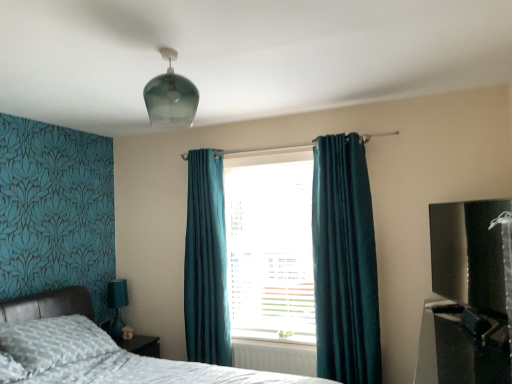
The width and height of the screenshot is (512, 384). Identify the location of vacant space situated above transparent glass light fixture at upper center (from a real-world perspective). (160, 56).